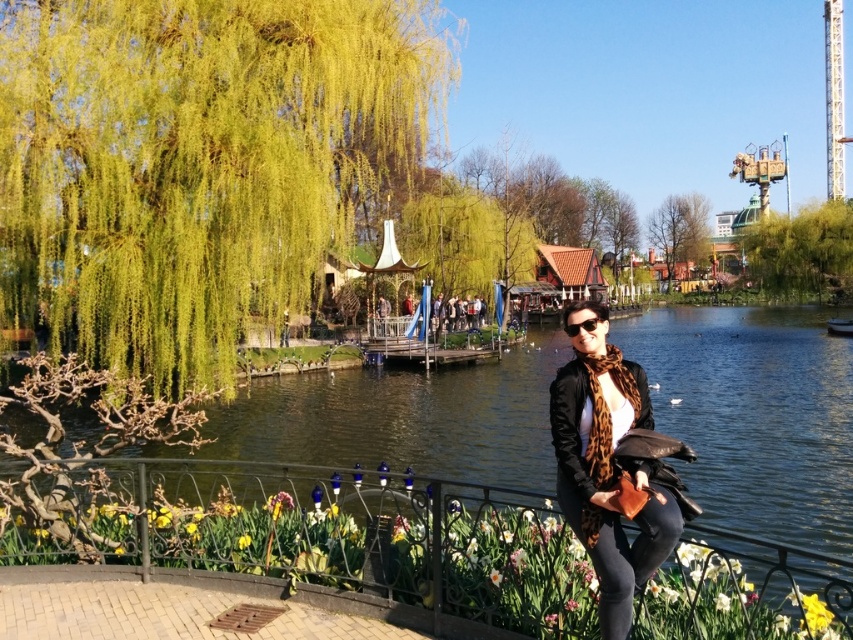
Question: Which point is farther from the camera taking this photo?

Choices:
 (A) (842, 208)
 (B) (569, 326)
 (C) (502, 579)

Answer: (A)

Question: Does green leafy tree at upper center appear on the right side of yellow matte flower at center?

Choices:
 (A) no
 (B) yes

Answer: (B)

Question: Which object is the closest to the white matte flower at center?

Choices:
 (A) yellow matte flower at center
 (B) green leafy tree at upper center

Answer: (A)

Question: Is green leafy tree at upper center to the left of yellow matte flower at center from the viewer's perspective?

Choices:
 (A) no
 (B) yes

Answer: (A)

Question: In this image, where is green leafy tree at upper right located relative to yellow matte flower at center?

Choices:
 (A) above
 (B) below

Answer: (A)

Question: Among these objects, which one is farthest from the camera?

Choices:
 (A) white matte flower at center
 (B) leopard print scarf at center
 (C) yellow matte flower at center
 (D) green leafy willow at upper left

Answer: (D)